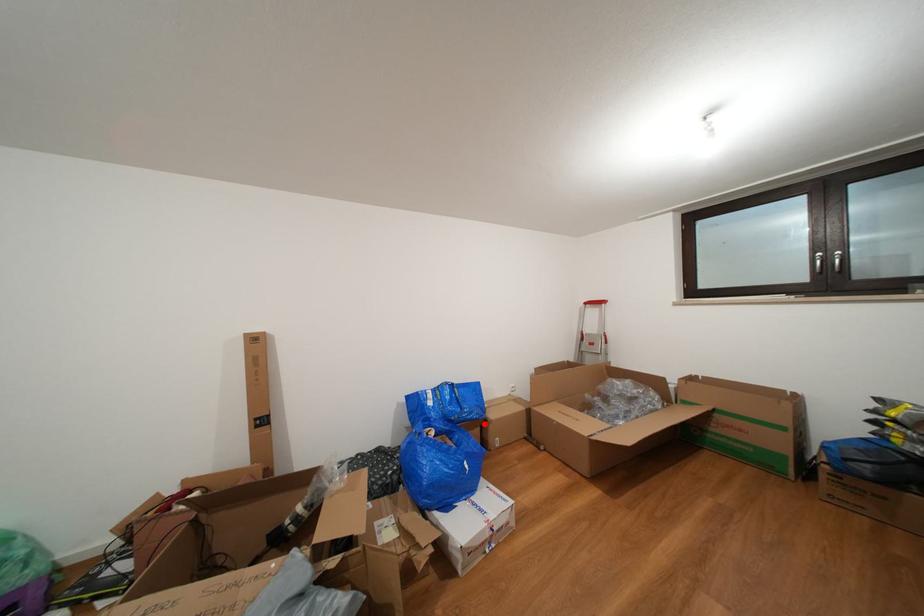
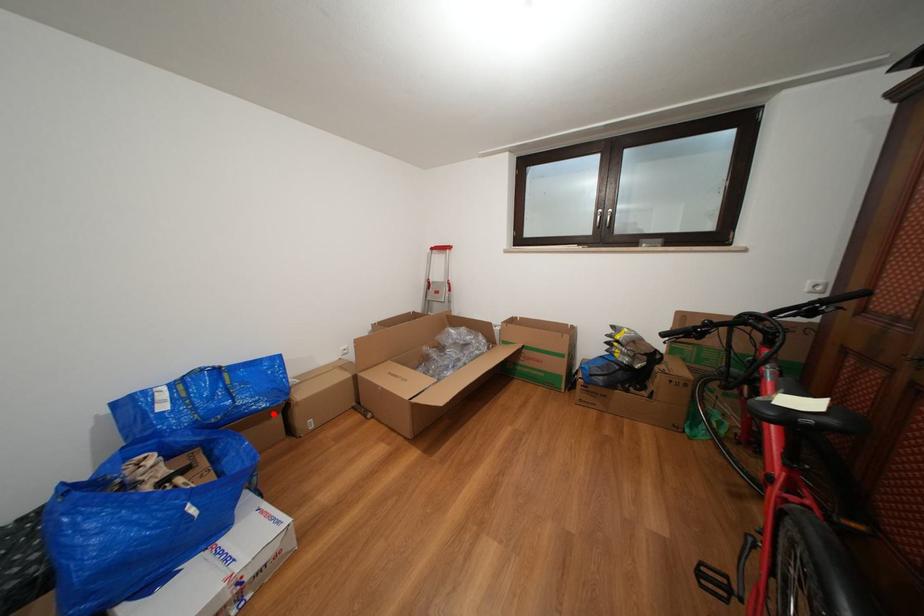
I am providing you with two images of the same scene from different viewpoints. A red point is marked on the first image and another point is marked on the second image. Are the points marked in image1 and image2 representing the same 3D position?

Yes